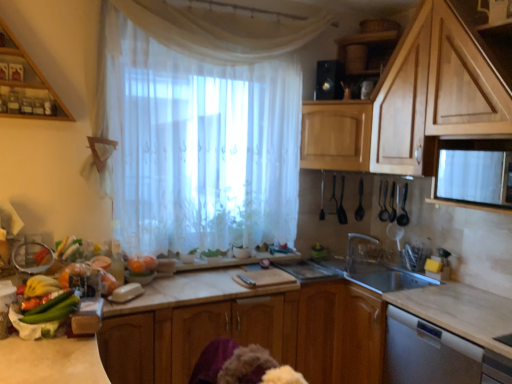
At what (x,y) coordinates should I click in order to perform the action: click on free point above white marble countertop at lower right (from a real-world perspective). Please return your answer as a coordinate pair (x, y). Looking at the image, I should click on (478, 307).